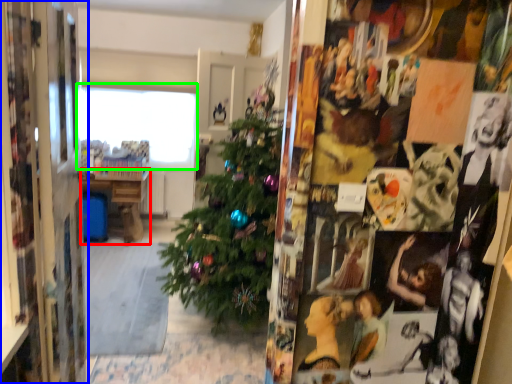
Question: Estimate the real-world distances between objects in this image. Which object is closer to table (highlighted by a red box), collage (highlighted by a blue box) or window (highlighted by a green box)?

Choices:
 (A) collage
 (B) window

Answer: (B)